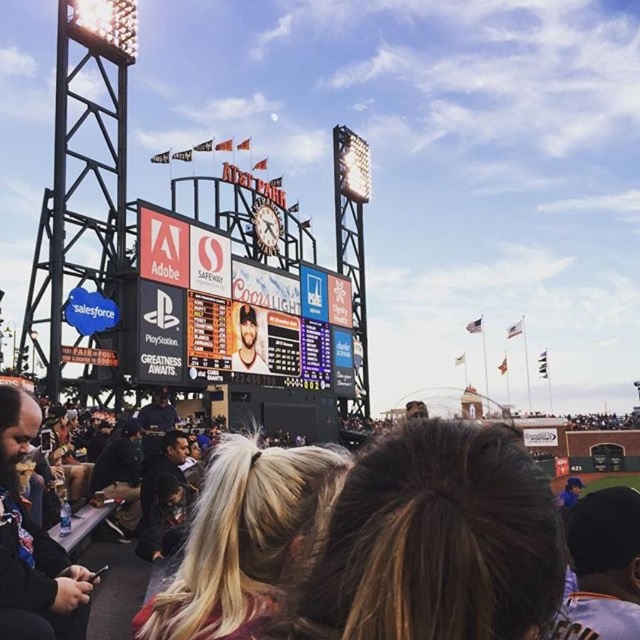
You are a photographer at the baseball stadium and want to take a photo of the black glossy scoreboard at center. The stadium has a grid system where each grid cell is 1 meter by 1 meter. If you are currently standing at position 0,0, which grid cell should you move to in order to be directly in front of the scoreboard?

The black glossy scoreboard at center is located at point (241, 310). To be directly in front of it, you should move to the grid cell closest to that coordinate, which would be approximately 0.486 meters along the x axis and 0.377 meters along the y axis from your current position at (0, 0).

You are a spectator at the baseball stadium and want to locate your friend who is wearing a dark brown leather jacket at lower left. You are currently looking at the black glossy scoreboard at center. In which direction should you look relative to the scoreboard to find your friend?

The dark brown leather jacket at lower left is below the black glossy scoreboard at center, so you should look downward from the scoreboard to find your friend.